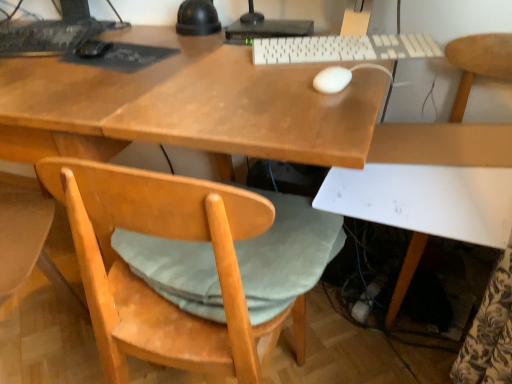
Where is `empty space that is in between white plastic keyboard at center, the 1th computer keyboard when ordered from front to back, and white matte mouse at center, which is the 2th mouse from back to front`? This screenshot has height=384, width=512. empty space that is in between white plastic keyboard at center, the 1th computer keyboard when ordered from front to back, and white matte mouse at center, which is the 2th mouse from back to front is located at coordinates (330, 66).